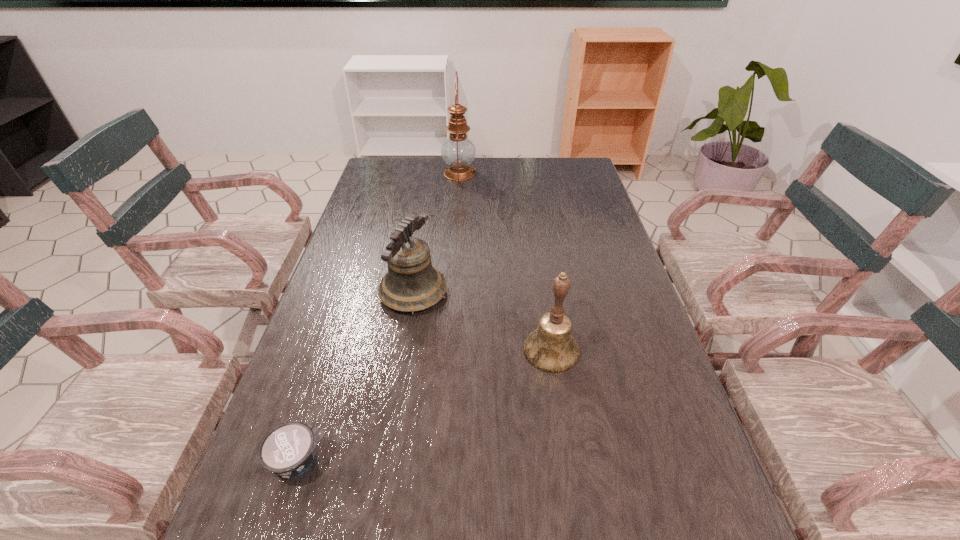
Where is `oil lamp`? This screenshot has height=540, width=960. oil lamp is located at coordinates (458, 151).

I want to click on the farthest object, so click(x=458, y=151).

Locate an element on the screen. the nearer bell is located at coordinates (551, 347).

You are a GUI agent. You are given a task and a screenshot of the screen. Output one action in this format:
    pyautogui.click(x=<x>, y=<y>)
    Task: Click on the rightmost object
    The width and height of the screenshot is (960, 540).
    Given the screenshot: What is the action you would take?
    pyautogui.click(x=551, y=347)

Locate an element on the screen. The height and width of the screenshot is (540, 960). the left bell is located at coordinates (412, 284).

What are the coordinates of `the farther bell` in the screenshot? It's located at (412, 284).

Identify the location of yogurt. (288, 450).

The height and width of the screenshot is (540, 960). I want to click on the shortest object, so click(288, 450).

Locate an element on the screen. vacant space located 0.060m on the right of the farthest object is located at coordinates (492, 173).

Identify the location of free space located 0.240m on the back of the rightmost object. (539, 266).